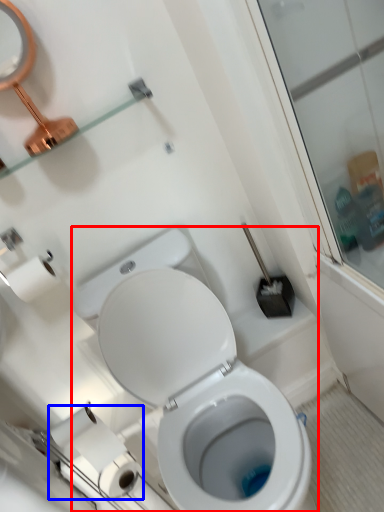
Question: Which of the following is the farthest to the observer, toilet (highlighted by a red box) or toilet paper (highlighted by a blue box)?

Choices:
 (A) toilet
 (B) toilet paper

Answer: (B)